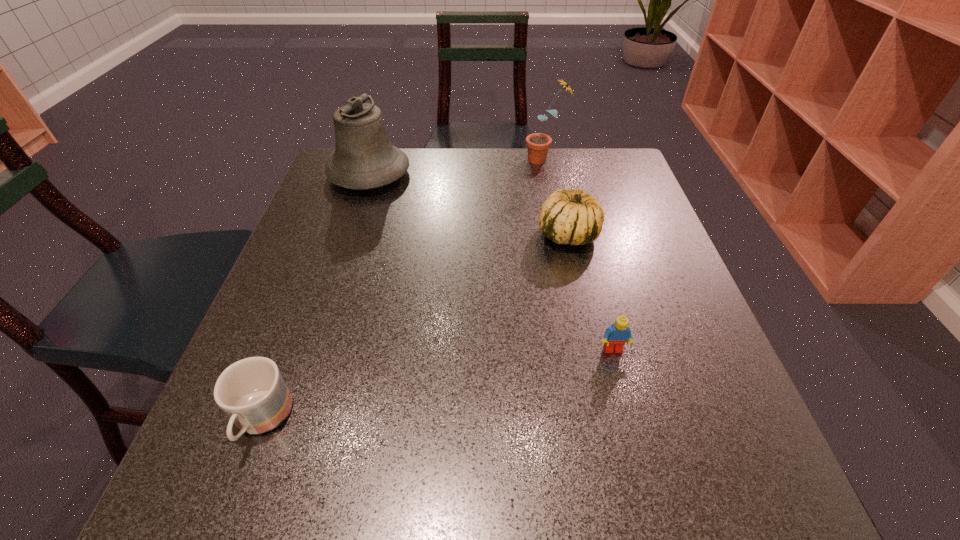
In order to click on vacant area that lies between the mug and the third nearest object in this screenshot , I will do `click(415, 327)`.

Where is `vacant area that lies between the nearest object and the sunflower`? vacant area that lies between the nearest object and the sunflower is located at coordinates (403, 290).

The height and width of the screenshot is (540, 960). Identify the location of free point between the third nearest object and the Lego. (590, 292).

The width and height of the screenshot is (960, 540). What are the coordinates of `free space between the nearest object and the second nearest object` in the screenshot? It's located at (438, 385).

Find the location of a particular element. The height and width of the screenshot is (540, 960). free spot between the bell and the mug is located at coordinates (315, 298).

Image resolution: width=960 pixels, height=540 pixels. Identify the location of vacant area that lies between the sunflower and the bell. (457, 167).

Where is `vacant space that's between the sunflower and the mug`? vacant space that's between the sunflower and the mug is located at coordinates (403, 290).

Locate an element on the screen. free space between the third shortest object and the Lego is located at coordinates [x=590, y=292].

Locate an element on the screen. The image size is (960, 540). vacant area between the nearest object and the gourd is located at coordinates (415, 327).

Identify which object is the third closest to the sunflower. Please provide its 2D coordinates. Your answer should be formatted as a tuple, i.e. [(x, y)], where the tuple contains the x and y coordinates of a point satisfying the conditions above.

[(615, 336)]